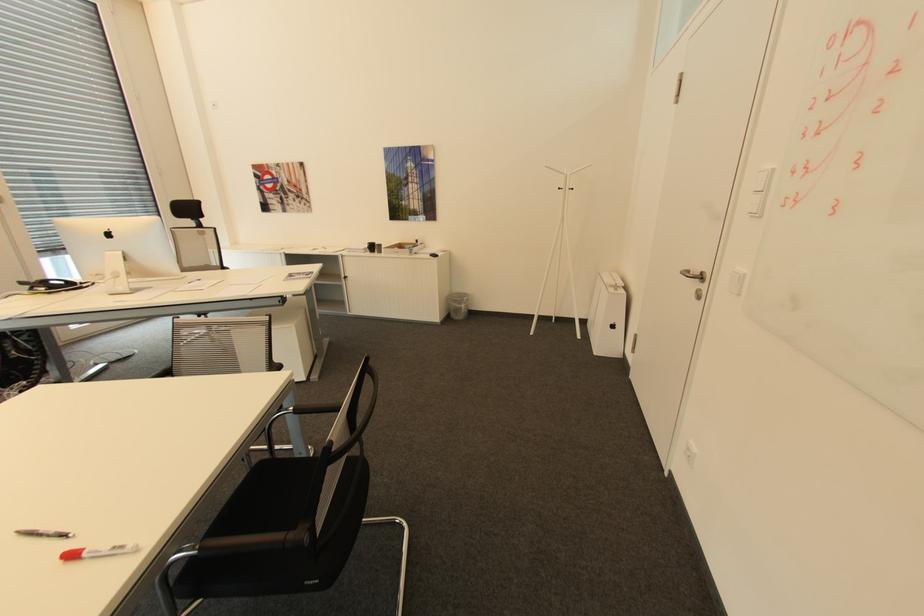
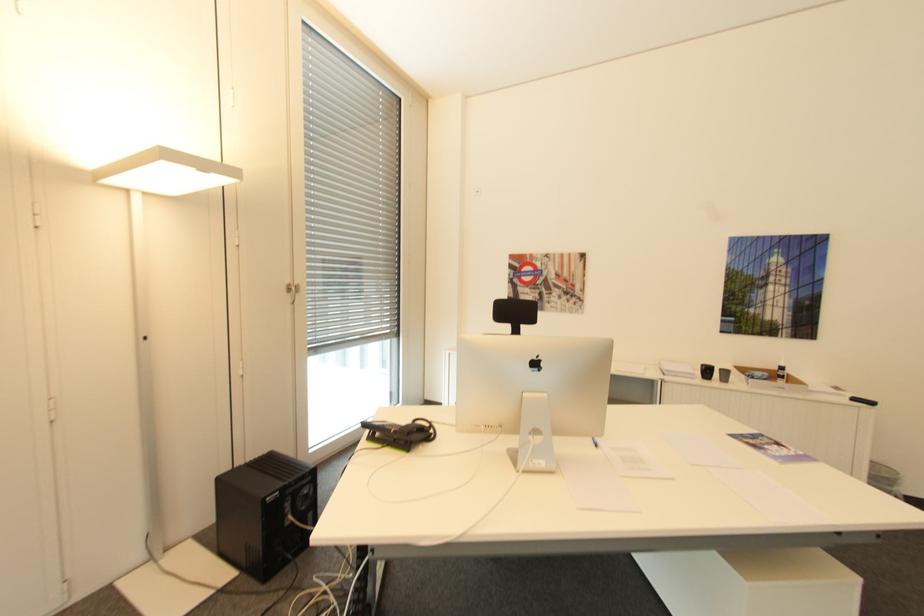
The images are taken continuously from a first-person perspective. In which direction are you moving?

The cameraman walked toward left, forward.